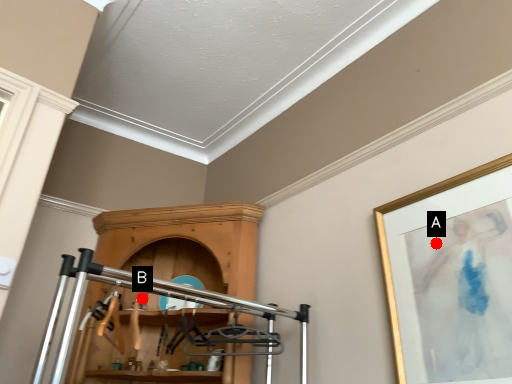
Question: Two points are circled on the image, labeled by A and B beside each circle. Which point is farther from the camera taking this photo?

Choices:
 (A) A is further
 (B) B is further

Answer: (B)